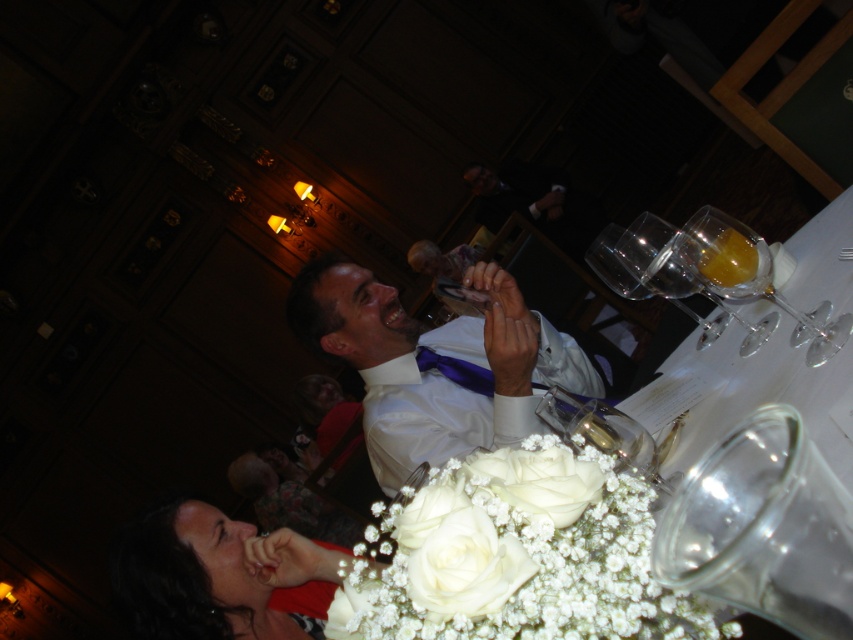
Question: Estimate the real-world distances between objects in this image. Which object is closer to the clear glass wine glass at center?

Choices:
 (A) translucent glass champagne at upper right
 (B) transparent glass wine glass at upper right

Answer: (A)

Question: Which object appears closest to the camera in this image?

Choices:
 (A) clear glass wine glass at center
 (B) white silk flowers at lower center

Answer: (B)

Question: Does smooth white dress at lower left lie in front of translucent glass champagne at upper right?

Choices:
 (A) no
 (B) yes

Answer: (A)

Question: Observing the image, what is the correct spatial positioning of transparent glass wine glass at upper right in reference to clear glass wine glass at center?

Choices:
 (A) below
 (B) above

Answer: (B)

Question: Can you confirm if transparent glass wine glass at upper right is thinner than clear glass wine glass at center?

Choices:
 (A) yes
 (B) no

Answer: (B)

Question: Which object appears farthest from the camera in this image?

Choices:
 (A) white satin shirt at center
 (B) smooth white dress at lower left
 (C) white silk flowers at lower center

Answer: (A)